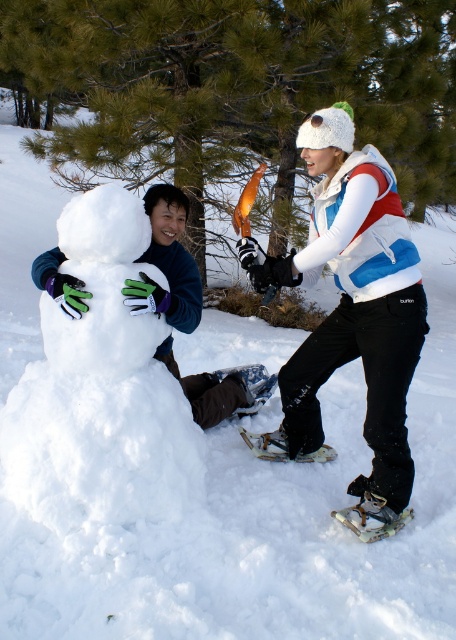
How much distance is there between white fluffy snowman at left and white plastic snowshoe at lower center?

white fluffy snowman at left is 1.20 meters from white plastic snowshoe at lower center.

Which is in front, point (74, 404) or point (253, 445)?

Point (74, 404) is more forward.

Between point (184, 401) and point (257, 456), which one is positioned behind?

Positioned behind is point (257, 456).

The height and width of the screenshot is (640, 456). In order to click on white fluffy snowman at left in this screenshot , I will do `click(99, 392)`.

Is point (332, 204) farther from camera compared to point (279, 458)?

No.

Who is shorter, white fleece jacket at upper right or white plastic snowshoe at lower center?

white plastic snowshoe at lower center is shorter.

You are a GUI agent. You are given a task and a screenshot of the screen. Output one action in this format:
    pyautogui.click(x=<x>, y=<y>)
    Task: Click on the white fleece jacket at upper right
    This screenshot has height=640, width=456.
    Given the screenshot: What is the action you would take?
    pyautogui.click(x=352, y=300)

You are a GUI agent. You are given a task and a screenshot of the screen. Output one action in this format:
    pyautogui.click(x=<x>, y=<y>)
    Task: Click on the white fleece jacket at upper right
    Image resolution: width=456 pixels, height=640 pixels.
    Given the screenshot: What is the action you would take?
    pyautogui.click(x=352, y=300)

Who is shorter, metallic silver snowshoe at lower right or white plastic snowshoe at lower center?

With less height is metallic silver snowshoe at lower right.

Based on the photo, can you confirm if metallic silver snowshoe at lower right is smaller than white plastic snowshoe at lower center?

Yes, metallic silver snowshoe at lower right is smaller than white plastic snowshoe at lower center.

Who is more distant from viewer, (402,518) or (273,436)?

Point (273,436)

Locate an element on the screen. The height and width of the screenshot is (640, 456). metallic silver snowshoe at lower right is located at coordinates (373, 516).